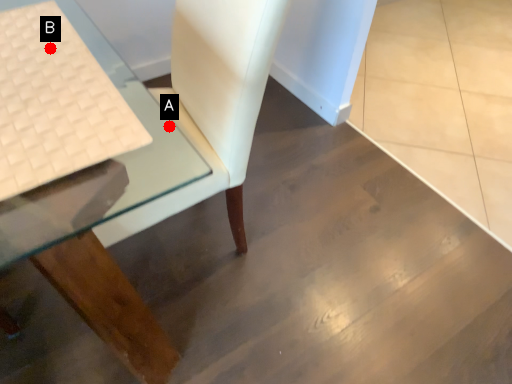
Question: Two points are circled on the image, labeled by A and B beside each circle. Which point is farther from the camera taking this photo?

Choices:
 (A) A is further
 (B) B is further

Answer: (A)